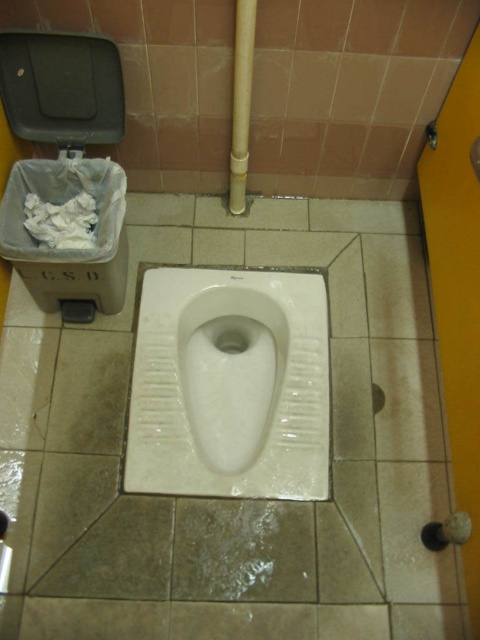
Is white glossy toilet bowl at center below white fluffy tissue at left?

Indeed, white glossy toilet bowl at center is positioned under white fluffy tissue at left.

This screenshot has height=640, width=480. In order to click on white glossy toilet bowl at center in this screenshot , I will do `click(230, 372)`.

Who is more forward, (179, 444) or (24, 112)?

Point (179, 444) is in front.

Is point (287, 282) more distant than point (25, 67)?

Yes, point (287, 282) is behind point (25, 67).

This screenshot has height=640, width=480. Identify the location of white ceramic urinal at center. (274, 401).

Is white glossy toilet bowl at center thinner than black plastic lid at upper left?

Correct, white glossy toilet bowl at center's width is less than black plastic lid at upper left's.

Is point (199, 316) closer to viewer compared to point (78, 72)?

That is False.

Locate an element on the screen. white glossy toilet bowl at center is located at coordinates (230, 372).